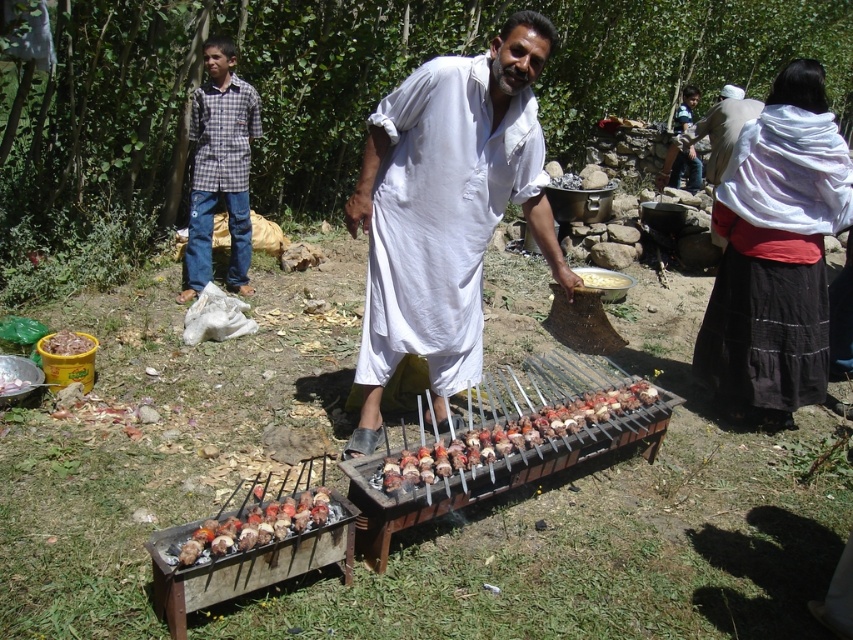
Question: Which of the following is the closest to the observer?

Choices:
 (A) charcoal grilled skewers at center
 (B) meat chunks at lower left
 (C) white cloth at center

Answer: (A)

Question: Does charcoal grilled meat skewers at center lie in front of white cotton robe at center?

Choices:
 (A) yes
 (B) no

Answer: (A)

Question: Is white textured scarf at right bigger than charcoal grilled meat skewers at center?

Choices:
 (A) no
 (B) yes

Answer: (B)

Question: Estimate the real-world distances between objects in this image. Which object is farther from the meat chunks at lower left?

Choices:
 (A) charcoal grilled meat skewers at center
 (B) white cotton robe at center

Answer: (B)

Question: Considering the relative positions of white cotton robe at center and meat chunks at lower left in the image provided, where is white cotton robe at center located with respect to meat chunks at lower left?

Choices:
 (A) left
 (B) right

Answer: (B)

Question: Which point is closer to the camera taking this photo?

Choices:
 (A) (51, 342)
 (B) (242, 524)
 (C) (19, 385)
 (D) (840, 168)

Answer: (B)